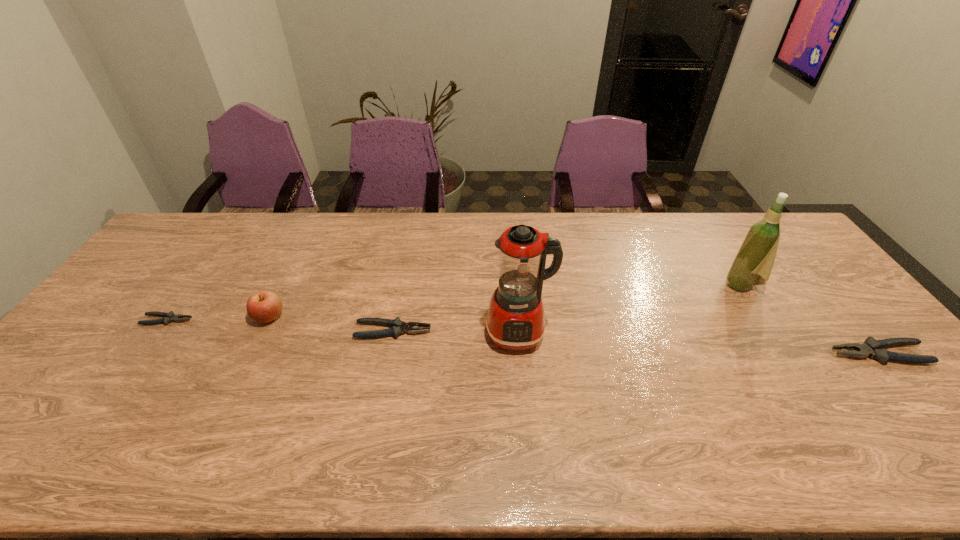
The height and width of the screenshot is (540, 960). Identify the location of free location located on the front of the third tallest object. (237, 384).

Find the location of a particular element. Image resolution: width=960 pixels, height=540 pixels. object that is at the left edge is located at coordinates (169, 317).

Find the location of `object situated at the right edge`. object situated at the right edge is located at coordinates (871, 347).

Identify the location of free spot at the far edge of the desktop. The image size is (960, 540). (659, 221).

You are a GUI agent. You are given a task and a screenshot of the screen. Output one action in this format:
    pyautogui.click(x=<x>, y=<y>)
    Task: Click on the vacant point at the near edge
    
    Given the screenshot: What is the action you would take?
    pyautogui.click(x=843, y=395)

Locate an element on the screen. Image resolution: width=960 pixels, height=540 pixels. vacant space at the left edge of the desktop is located at coordinates (154, 276).

In the image, there is a desktop. Where is `free space at the right edge`? This screenshot has width=960, height=540. free space at the right edge is located at coordinates (809, 321).

In order to click on vacant space at the far left corner of the desktop in this screenshot , I will do `click(181, 246)`.

This screenshot has height=540, width=960. In order to click on unoccupied position between the leftmost pliers and the farthest object in this screenshot , I will do `click(454, 303)`.

Where is `empty space between the fourth object from left to right and the second shortest object`? empty space between the fourth object from left to right and the second shortest object is located at coordinates (456, 332).